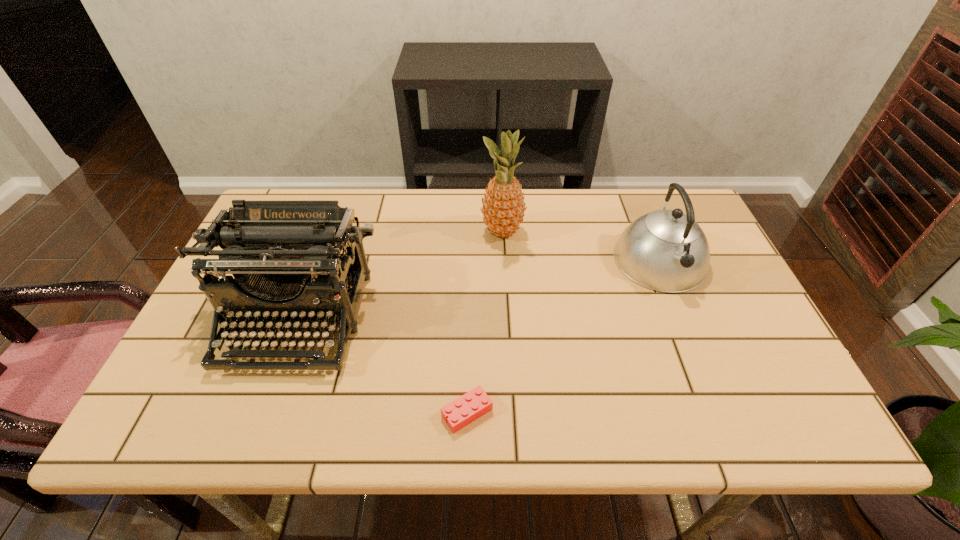
Locate an element on the screen. The width and height of the screenshot is (960, 540). blank region between the rightmost object and the typewriter is located at coordinates (478, 290).

The width and height of the screenshot is (960, 540). Find the location of `unoccupied position between the shortest object and the leftmost object`. unoccupied position between the shortest object and the leftmost object is located at coordinates (382, 366).

You are a GUI agent. You are given a task and a screenshot of the screen. Output one action in this format:
    pyautogui.click(x=<x>, y=<y>)
    Task: Click on the vacant point located between the shortest object and the tallest object
    This screenshot has height=540, width=960.
    Given the screenshot: What is the action you would take?
    pyautogui.click(x=485, y=322)

At what (x,y) coordinates should I click in order to perform the action: click on vacant area that lies between the nearest object and the rightmost object. Please return your answer as a coordinate pair (x, y). The image size is (960, 540). Looking at the image, I should click on (564, 337).

Find the location of a particular element. empty space between the rightmost object and the typewriter is located at coordinates (478, 290).

The width and height of the screenshot is (960, 540). I want to click on vacant point located between the rightmost object and the leftmost object, so click(478, 290).

Find the location of a particular element. free space between the kettle and the pineapple is located at coordinates (581, 247).

Where is `free spot between the Lego and the tallest object`? The height and width of the screenshot is (540, 960). free spot between the Lego and the tallest object is located at coordinates (485, 322).

At what (x,y) coordinates should I click in order to perform the action: click on the third closest object relative to the kettle. Please return your answer as a coordinate pair (x, y). The width and height of the screenshot is (960, 540). Looking at the image, I should click on (283, 255).

Point out which object is positioned as the third nearest to the nearest object. Please provide its 2D coordinates. Your answer should be formatted as a tuple, i.e. [(x, y)], where the tuple contains the x and y coordinates of a point satisfying the conditions above.

[(503, 208)]